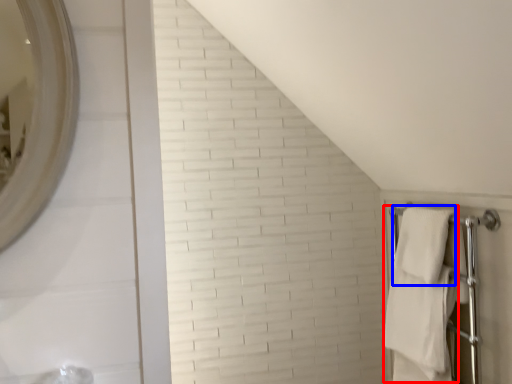
Question: Which object is further to the camera taking this photo, bath towel (highlighted by a red box) or bath towel (highlighted by a blue box)?

Choices:
 (A) bath towel
 (B) bath towel

Answer: (A)